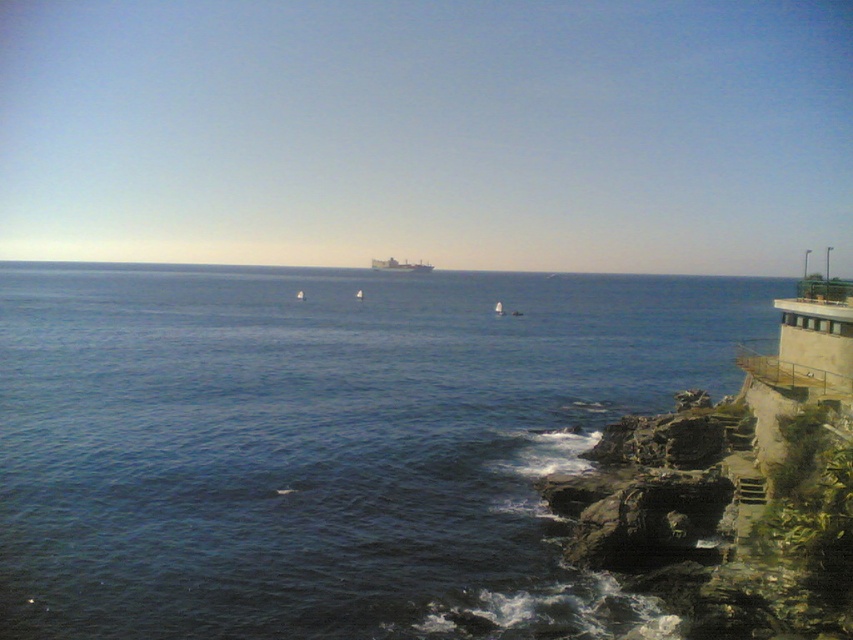
Question: Which of the following is the closest to the observer?

Choices:
 (A) metallic gray ship at center
 (B) blue water at lower left

Answer: (B)

Question: Is blue water at lower left positioned behind metallic gray ship at center?

Choices:
 (A) yes
 (B) no

Answer: (B)

Question: Observing the image, what is the correct spatial positioning of blue water at lower left in reference to metallic gray ship at center?

Choices:
 (A) right
 (B) left

Answer: (A)

Question: Where is blue water at lower left located in relation to metallic gray ship at center in the image?

Choices:
 (A) below
 (B) above

Answer: (A)

Question: Which object is farther from the camera taking this photo?

Choices:
 (A) blue water at lower left
 (B) metallic gray ship at center

Answer: (B)